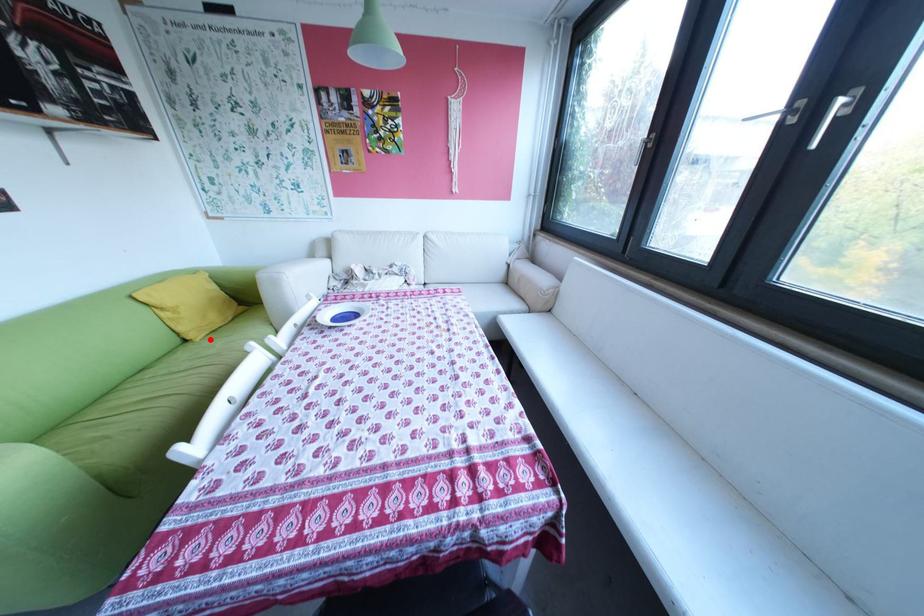
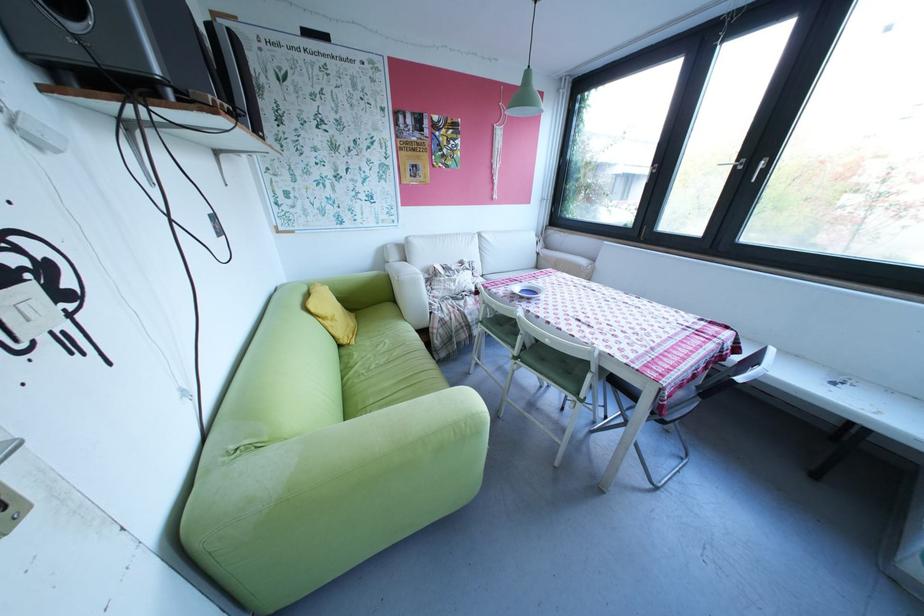
The point at the highlighted location is marked in the first image. Where is the corresponding point in the second image?

(366, 342)